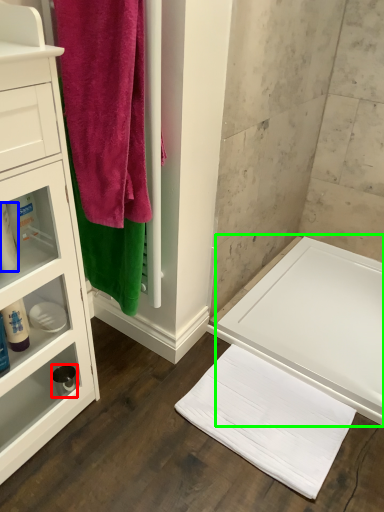
Question: Based on their relative distances, which object is nearer to toiletry (highlighted by a red box)? Choose from toiletry (highlighted by a blue box) and bath (highlighted by a green box).

Choices:
 (A) toiletry
 (B) bath

Answer: (A)